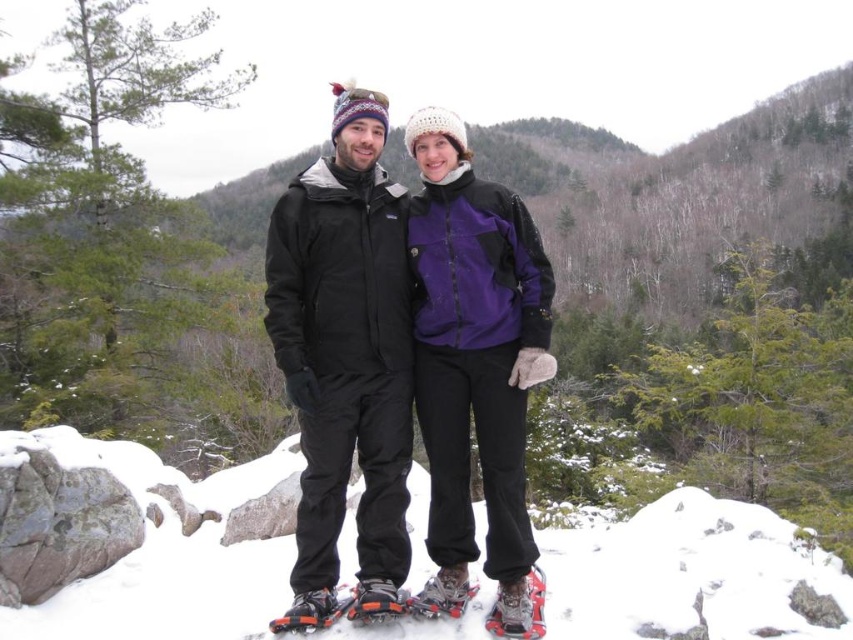
Is white fluffy snow at center wider than brushed metal snowshoe at lower center?

In fact, white fluffy snow at center might be narrower than brushed metal snowshoe at lower center.

Does white fluffy snow at center appear on the right side of brushed metal snowshoe at lower center?

Correct, you'll find white fluffy snow at center to the right of brushed metal snowshoe at lower center.

Who is more distant from viewer, (181, 624) or (519, 595)?

Point (181, 624)

I want to click on white fluffy snow at center, so click(x=158, y=552).

From the picture: Can you confirm if matte black snowsuit at center is positioned above purple fleece jacket at center?

Actually, matte black snowsuit at center is below purple fleece jacket at center.

Is point (294, 289) farther from viewer compared to point (450, 349)?

No.

This screenshot has height=640, width=853. In order to click on matte black snowsuit at center in this screenshot , I will do `click(346, 340)`.

Is the position of purple fleece jacket at center more distant than that of silver metallic snowshoe at center?

No, it is in front of silver metallic snowshoe at center.

Can you confirm if purple fleece jacket at center is shorter than silver metallic snowshoe at center?

No.

Locate an element on the screen. The image size is (853, 640). purple fleece jacket at center is located at coordinates (476, 358).

The width and height of the screenshot is (853, 640). I want to click on purple fleece jacket at center, so click(476, 358).